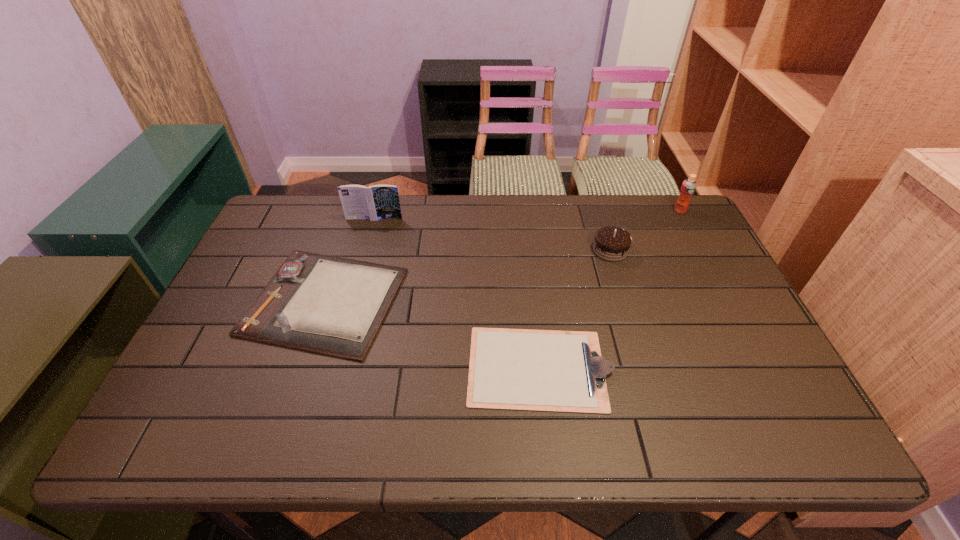
Find the location of `vacant space that satisfies the following two spatial constraints: 1. on the front cover of the second farthest object; 2. on the right side of the chocolate cake`. vacant space that satisfies the following two spatial constraints: 1. on the front cover of the second farthest object; 2. on the right side of the chocolate cake is located at coordinates (366, 250).